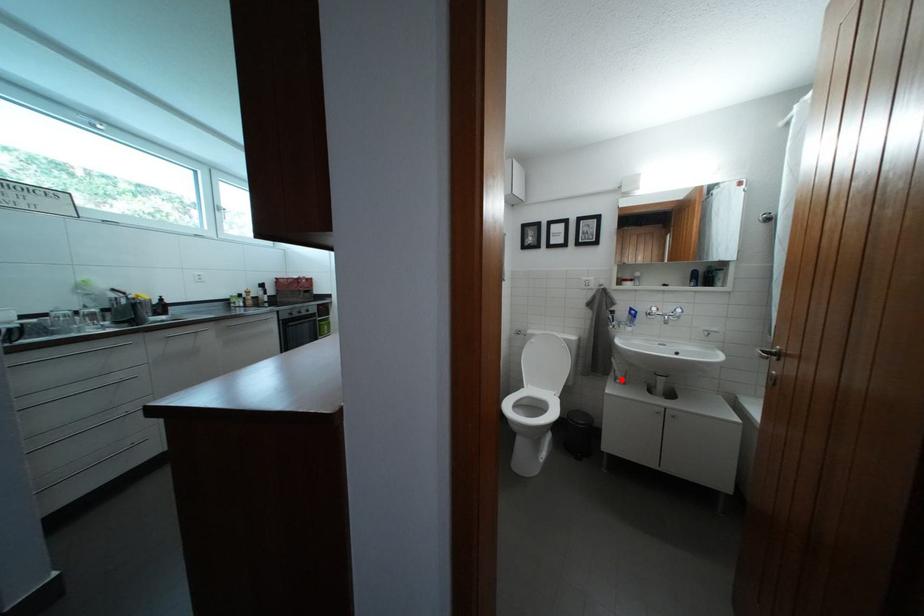
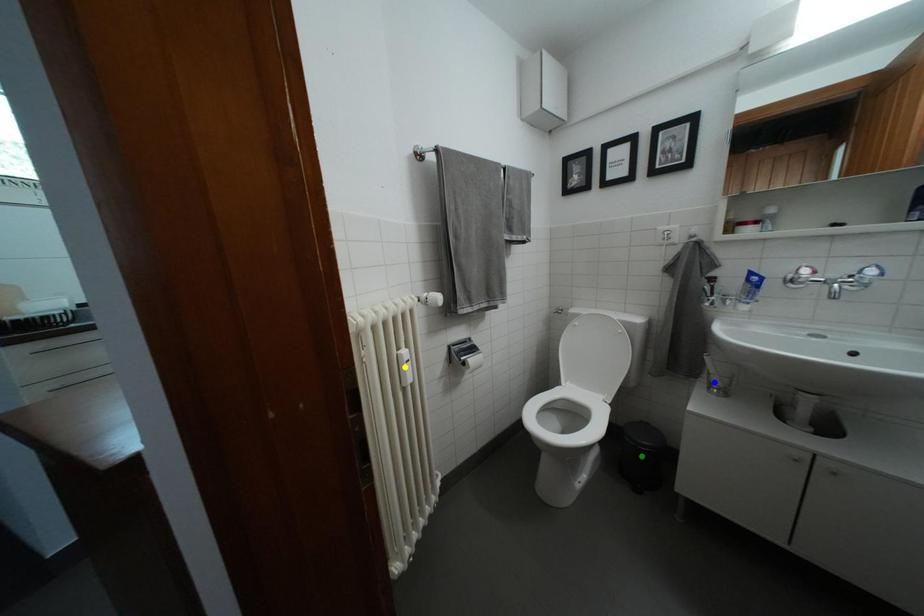
Question: I am providing you with two images of the same scene from different viewpoints. A red point is marked on the first image. You are given multiple points on the second image. In image 2, which mark is for the same physical point as the one in image 1?

Choices:
 (A) yellow point
 (B) green point
 (C) blue point

Answer: (C)